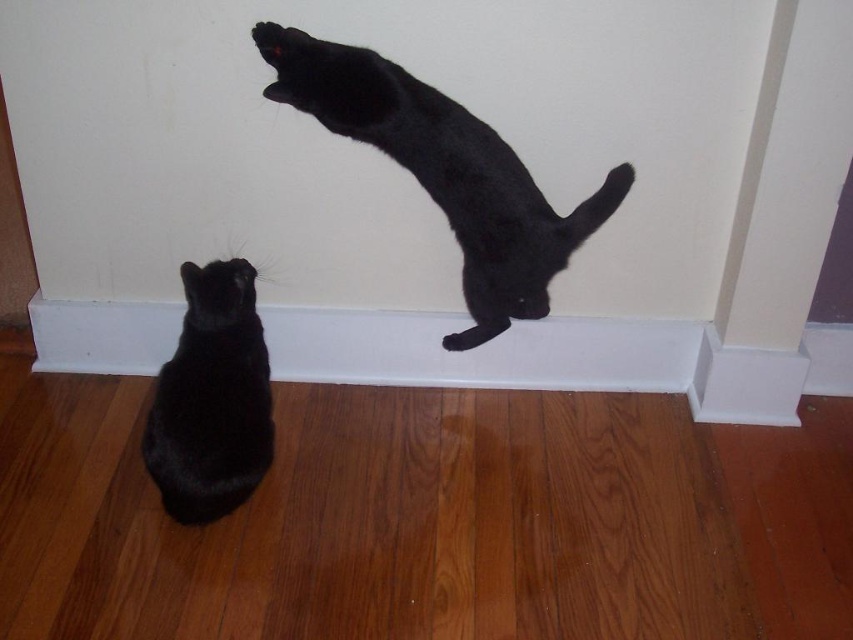
In the scene shown: Who is taller, black matte cat at upper center or matte black cat at lower left?

Standing taller between the two is black matte cat at upper center.

From the picture: Which is below, black matte cat at upper center or matte black cat at lower left?

matte black cat at lower left

What are the coordinates of `black matte cat at upper center` in the screenshot? It's located at (444, 172).

At what (x,y) coordinates should I click in order to perform the action: click on black matte cat at upper center. Please return your answer as a coordinate pair (x, y). The height and width of the screenshot is (640, 853). Looking at the image, I should click on (444, 172).